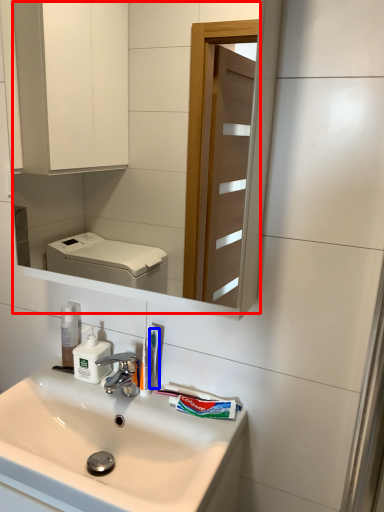
Question: Among these objects, which one is nearest to the camera, mirror (highlighted by a red box) or toothbrush (highlighted by a blue box)?

Choices:
 (A) mirror
 (B) toothbrush

Answer: (A)